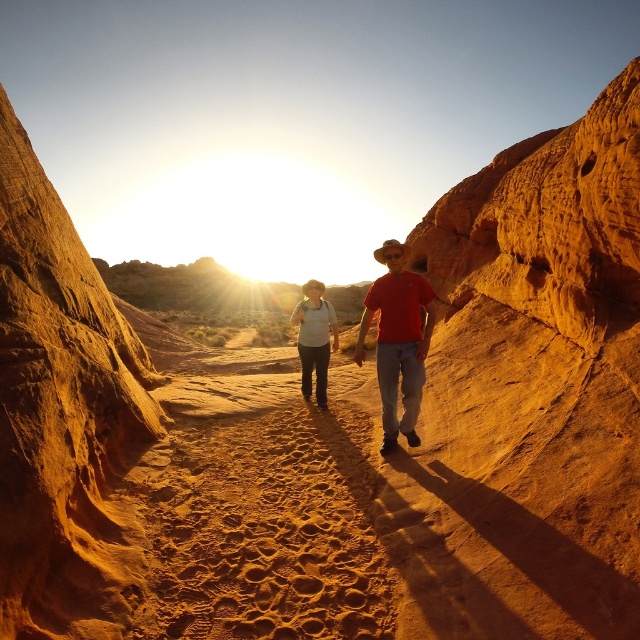
Question: Which of these objects is positioned farthest from the matte white shirt at center?

Choices:
 (A) matte red shirt at center
 (B) smooth sandstone rock at left

Answer: (B)

Question: Considering the real-world distances, which object is closest to the matte white shirt at center?

Choices:
 (A) smooth sandstone rock at left
 (B) matte red shirt at center

Answer: (B)

Question: Which point is closer to the camera?

Choices:
 (A) smooth sandstone rock at left
 (B) matte red shirt at center

Answer: (A)

Question: Does matte red shirt at center appear under matte white shirt at center?

Choices:
 (A) yes
 (B) no

Answer: (B)

Question: Does matte red shirt at center appear under matte white shirt at center?

Choices:
 (A) no
 (B) yes

Answer: (A)

Question: Can you confirm if matte red shirt at center is smaller than matte white shirt at center?

Choices:
 (A) yes
 (B) no

Answer: (B)